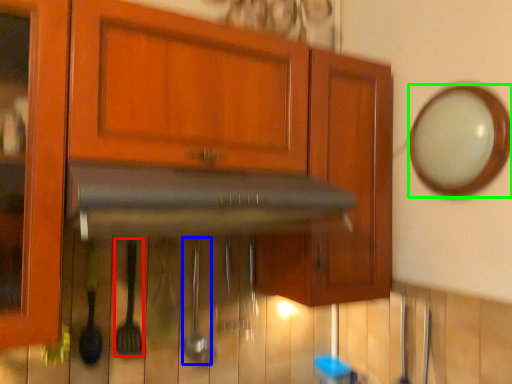
Question: Considering the real-world distances, which object is closest to silverware (highlighted by a red box)? silverware (highlighted by a blue box) or mirror (highlighted by a green box).

Choices:
 (A) silverware
 (B) mirror

Answer: (A)